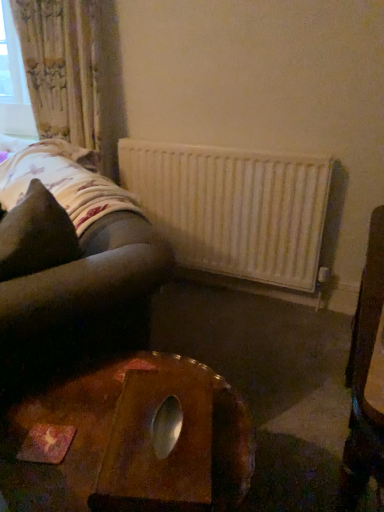
Question: Does wooden table at center appear on the right side of brown fabric pillow at left?

Choices:
 (A) yes
 (B) no

Answer: (A)

Question: Does wooden table at center have a lesser height compared to brown fabric pillow at left?

Choices:
 (A) no
 (B) yes

Answer: (A)

Question: Can you confirm if wooden table at center is bigger than brown fabric pillow at left?

Choices:
 (A) yes
 (B) no

Answer: (A)

Question: Does wooden table at center have a lesser width compared to brown fabric pillow at left?

Choices:
 (A) yes
 (B) no

Answer: (B)

Question: Is the surface of wooden table at center in direct contact with brown fabric pillow at left?

Choices:
 (A) no
 (B) yes

Answer: (A)

Question: From the image's perspective, is wooden table at center located beneath brown fabric pillow at left?

Choices:
 (A) yes
 (B) no

Answer: (A)

Question: Does white matte radiator at center have a smaller size compared to wooden table at center?

Choices:
 (A) yes
 (B) no

Answer: (A)

Question: Could you tell me if white matte radiator at center is turned towards wooden table at center?

Choices:
 (A) yes
 (B) no

Answer: (A)

Question: Can you confirm if white matte radiator at center is taller than wooden table at center?

Choices:
 (A) yes
 (B) no

Answer: (A)

Question: From a real-world perspective, is white matte radiator at center on top of wooden table at center?

Choices:
 (A) yes
 (B) no

Answer: (A)

Question: Is white matte radiator at center to the left of wooden table at center from the viewer's perspective?

Choices:
 (A) yes
 (B) no

Answer: (B)

Question: From a real-world perspective, is white matte radiator at center beneath wooden table at center?

Choices:
 (A) no
 (B) yes

Answer: (A)

Question: Considering the relative sizes of brown fabric pillow at left and floral fabric curtain at upper left in the image provided, is brown fabric pillow at left taller than floral fabric curtain at upper left?

Choices:
 (A) no
 (B) yes

Answer: (A)